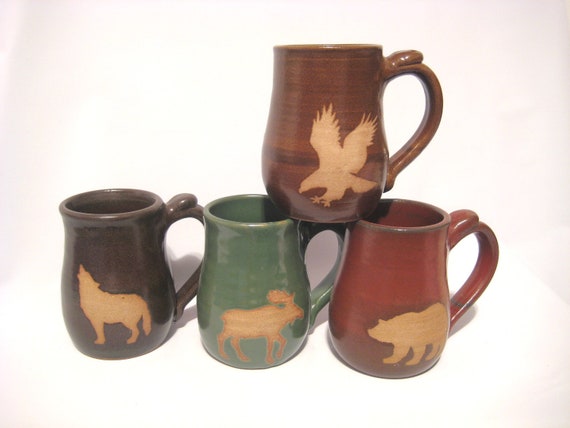
Locate an element on the screen. brown mug is located at coordinates (329, 87).